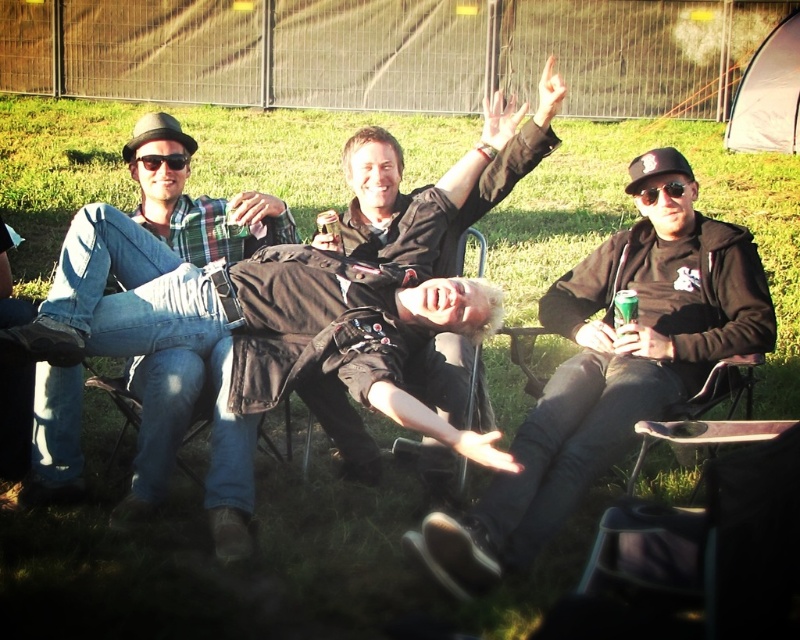
The height and width of the screenshot is (640, 800). What do you see at coordinates (166, 316) in the screenshot?
I see `jeans at center` at bounding box center [166, 316].

Is point (92, 275) positioned before point (340, 432)?

Yes, it is.

Is point (197, 339) positioned after point (437, 444)?

No, it is not.

What are the coordinates of `jeans at center` in the screenshot? It's located at (166, 316).

Who is more forward, (222, 547) or (322, 244)?

Point (222, 547)

Between point (220, 531) and point (326, 212), which one is positioned behind?

The point (326, 212) is behind.

Who is more distant from viewer, (280, 221) or (340, 248)?

The point (280, 221) is behind.

Identify the location of denim jeans at left. (198, 202).

Is metallic silver can at center to the left of green plastic cup at center from the viewer's perspective?

Indeed, metallic silver can at center is positioned on the left side of green plastic cup at center.

Which is above, metallic silver can at center or green plastic cup at center?

metallic silver can at center is higher up.

Is point (322, 218) closer to viewer compared to point (632, 305)?

No, (322, 218) is behind (632, 305).

Where is `metallic silver can at center`? metallic silver can at center is located at coordinates (328, 230).